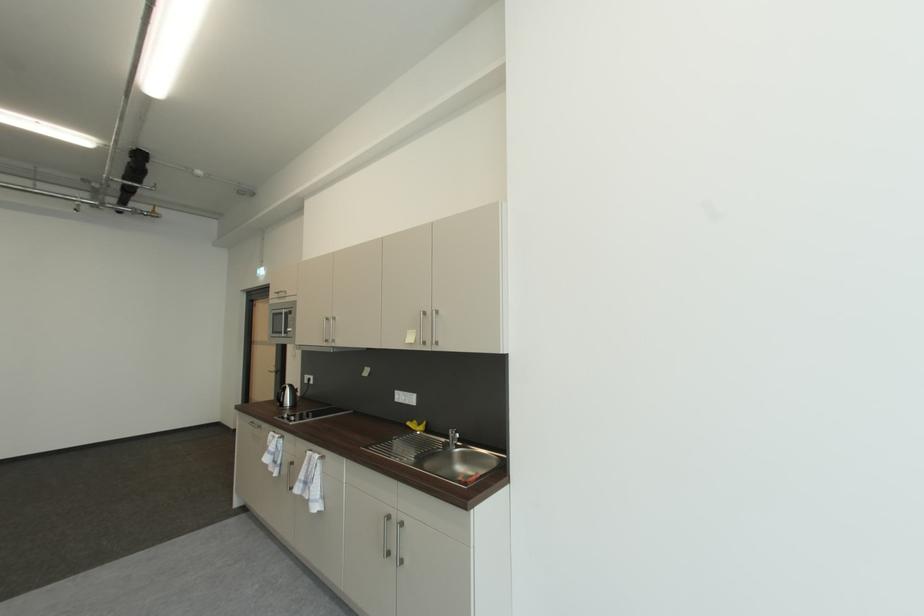
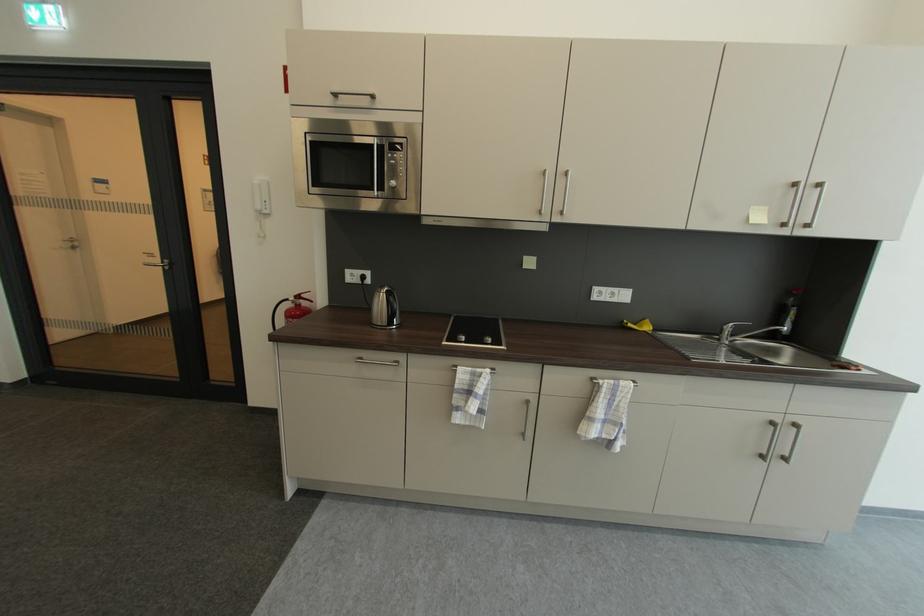
Where in the second image is the point corresponding to (x=281, y=371) from the first image?

(163, 262)